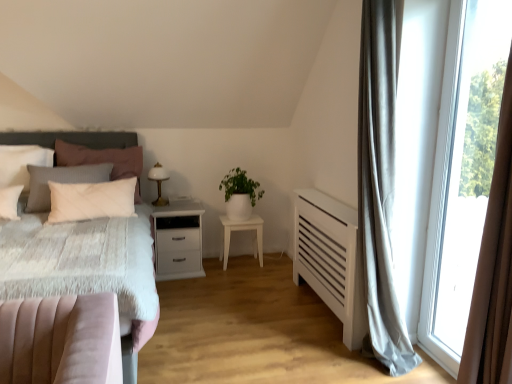
At what (x,y) coordinates should I click in order to perform the action: click on free space in front of white matte nightstand at center, the 1th nightstand in the right-to-left sequence. Please return your answer as a coordinate pair (x, y). Looking at the image, I should click on (243, 277).